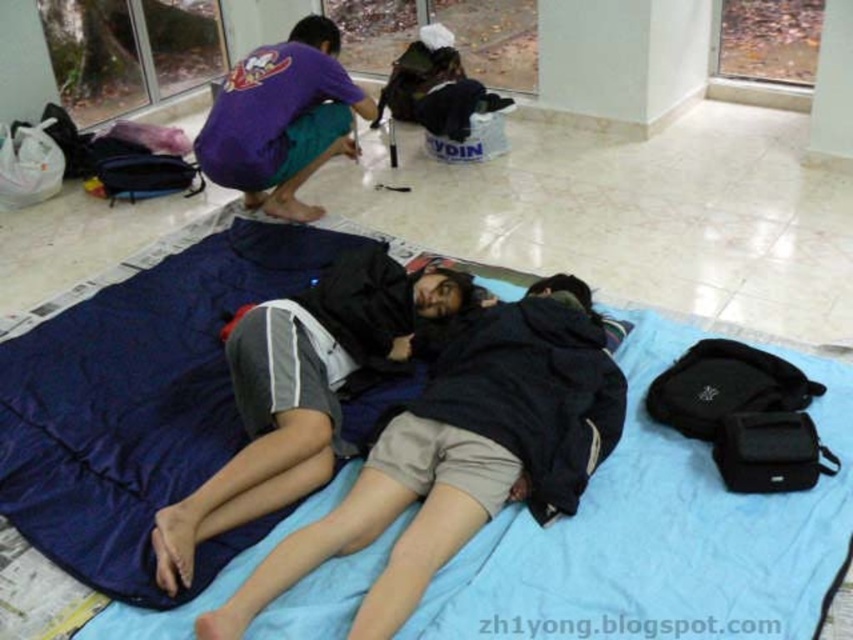
Question: Which object is positioned farthest from the blue fabric mat at lower center?

Choices:
 (A) purple cotton t-shirt at upper left
 (B) black fleece jacket at center

Answer: (B)

Question: Is black fleece jacket at center wider than purple cotton t-shirt at upper left?

Choices:
 (A) no
 (B) yes

Answer: (B)

Question: Which object appears farthest from the camera in this image?

Choices:
 (A) black fleece jacket at center
 (B) purple cotton t-shirt at upper left
 (C) blue fabric mat at lower center

Answer: (B)

Question: Which point is closer to the camera?

Choices:
 (A) black fleece jacket at center
 (B) purple cotton t-shirt at upper left

Answer: (A)

Question: Considering the relative positions of purple cotton t-shirt at upper left and blue fabric mat at lower center in the image provided, where is purple cotton t-shirt at upper left located with respect to blue fabric mat at lower center?

Choices:
 (A) above
 (B) below

Answer: (A)

Question: Can you confirm if black fleece jacket at center is positioned above blue fabric mat at lower center?

Choices:
 (A) yes
 (B) no

Answer: (B)